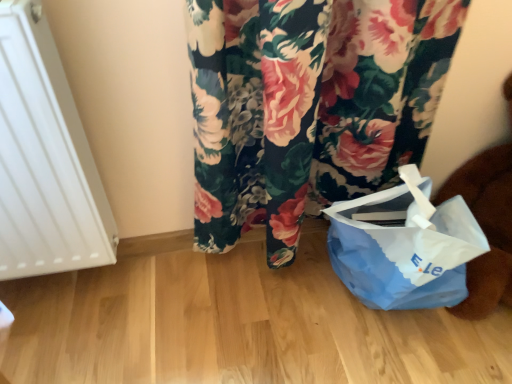
Question: Should I look upward or downward to see blue paper bag at lower right?

Choices:
 (A) up
 (B) down

Answer: (B)

Question: Considering the relative positions of white matte radiator at left and blue paper bag at lower right in the image provided, is white matte radiator at left to the right of blue paper bag at lower right from the viewer's perspective?

Choices:
 (A) yes
 (B) no

Answer: (B)

Question: Can blue paper bag at lower right be found inside white matte radiator at left?

Choices:
 (A) no
 (B) yes

Answer: (A)

Question: Is white matte radiator at left oriented towards blue paper bag at lower right?

Choices:
 (A) no
 (B) yes

Answer: (A)

Question: Is white matte radiator at left behind blue paper bag at lower right?

Choices:
 (A) yes
 (B) no

Answer: (B)

Question: Are white matte radiator at left and blue paper bag at lower right far apart?

Choices:
 (A) no
 (B) yes

Answer: (A)

Question: Considering the relative sizes of white matte radiator at left and blue paper bag at lower right in the image provided, is white matte radiator at left wider than blue paper bag at lower right?

Choices:
 (A) yes
 (B) no

Answer: (B)

Question: Is blue paper bag at lower right far from white matte radiator at left?

Choices:
 (A) no
 (B) yes

Answer: (A)

Question: Is white matte radiator at left at the back of blue paper bag at lower right?

Choices:
 (A) yes
 (B) no

Answer: (B)

Question: From a real-world perspective, is blue paper bag at lower right on top of white matte radiator at left?

Choices:
 (A) yes
 (B) no

Answer: (B)

Question: Can you confirm if blue paper bag at lower right is wider than white matte radiator at left?

Choices:
 (A) no
 (B) yes

Answer: (B)

Question: Are blue paper bag at lower right and white matte radiator at left beside each other?

Choices:
 (A) yes
 (B) no

Answer: (B)

Question: Would you say white matte radiator at left is part of blue paper bag at lower right's contents?

Choices:
 (A) yes
 (B) no

Answer: (B)

Question: From a real-world perspective, is blue paper bag at lower right positioned above or below white matte radiator at left?

Choices:
 (A) above
 (B) below

Answer: (B)